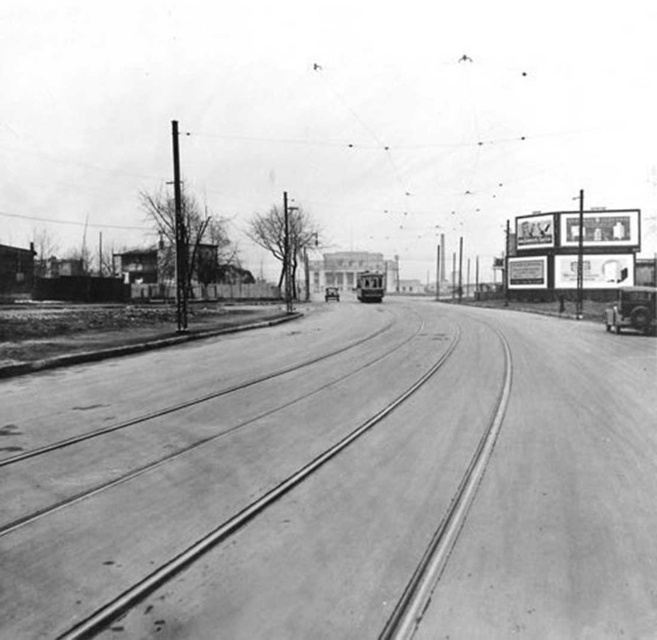
Between smooth asphalt train track at center and polished brass tram at center, which one is positioned lower?

Positioned lower is smooth asphalt train track at center.

Between point (359, 593) and point (369, 300), which one is positioned in front?

Point (359, 593) is more forward.

The height and width of the screenshot is (640, 657). Identify the location of smooth asphalt train track at center. (248, 480).

Is smooth asphalt train track at center bigger than shiny silver car at right?

Incorrect, smooth asphalt train track at center is not larger than shiny silver car at right.

Who is lower down, smooth asphalt train track at center or shiny silver car at right?

smooth asphalt train track at center is below.

At what (x,y) coordinates should I click in order to perform the action: click on smooth asphalt train track at center. Please return your answer as a coordinate pair (x, y). Looking at the image, I should click on (248, 480).

Based on the photo, is smooth asphalt train track at center thinner than metallic silver car at center?

In fact, smooth asphalt train track at center might be wider than metallic silver car at center.

Does smooth asphalt train track at center appear over metallic silver car at center?

Incorrect, smooth asphalt train track at center is not positioned above metallic silver car at center.

Is point (74, 499) positioned after point (325, 294)?

No, it is in front of (325, 294).

Where is `smooth asphalt train track at center`? Image resolution: width=657 pixels, height=640 pixels. smooth asphalt train track at center is located at coordinates (248, 480).